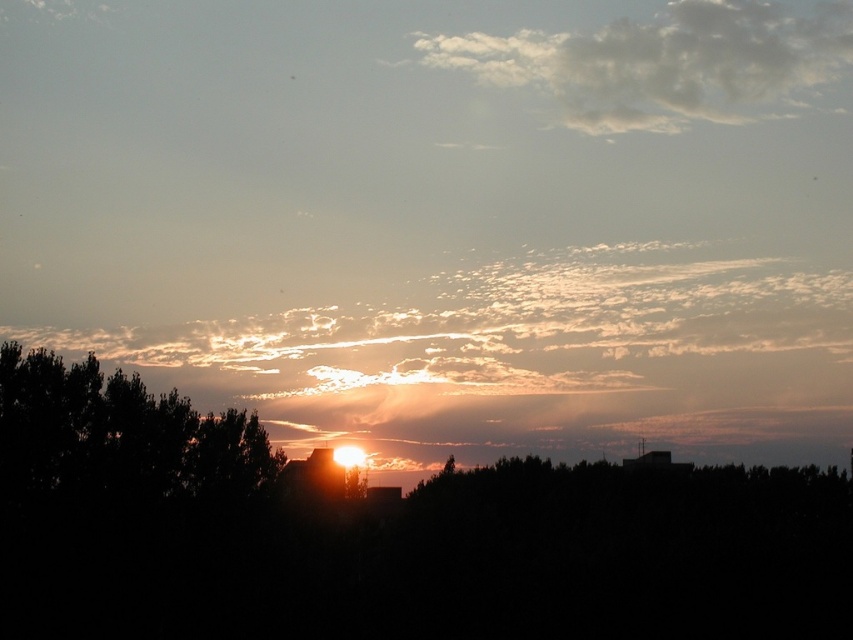
You are an artist painting the sunset scene. You want to ensure the clouds are layered correctly. Which cloud should you paint first, the translucent white cloud at center or the white fluffy cloud at upper center?

You should paint the white fluffy cloud at upper center first because the translucent white cloud at center is positioned under it, meaning it needs to be layered below the upper cloud.

You are an artist trying to paint the sunset scene. You notice the silhouette leafy tree at center and the translucent white cloud at center. Which object is located to the right of the other?

The silhouette leafy tree at center is positioned on the right side of the translucent white cloud at center.

You are standing in the sunset scene and want to take a photo. You notice two points in the image labeled as point 1 at coordinates point (90, 490) and point 2 at coordinates point (822, 17). Which point should you focus on first if you want to capture the closest object to your camera in the scene?

Point 1 at coordinates point (90, 490) is closer to the camera than point 2 at coordinates point (822, 17), so you should focus on point 1 first to capture the closest object.